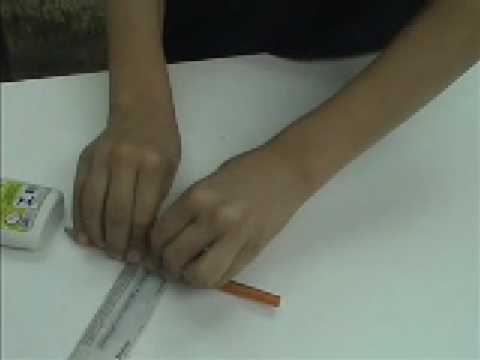
Identify the location of white table surface. This screenshot has width=480, height=360. (251, 97), (34, 129), (400, 238), (201, 333), (39, 315).